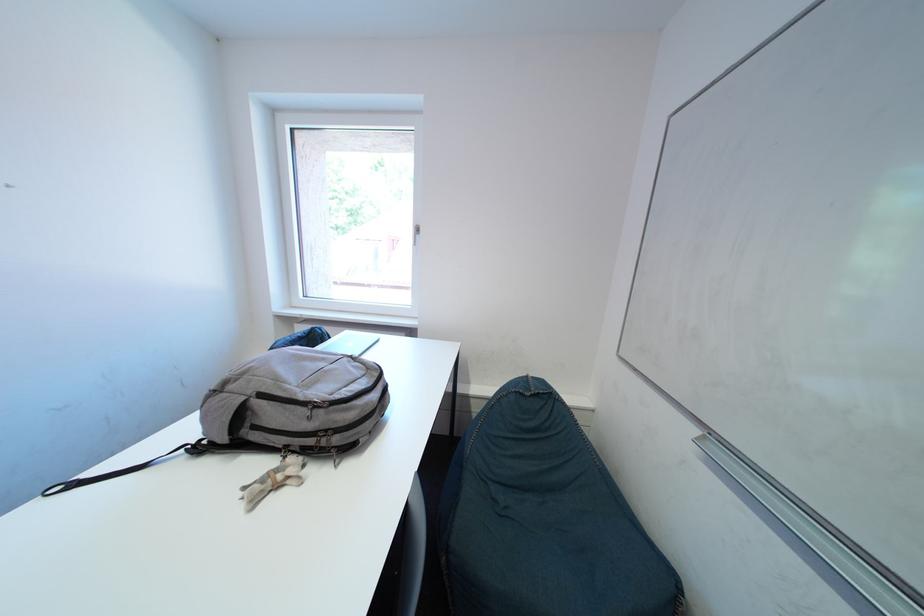
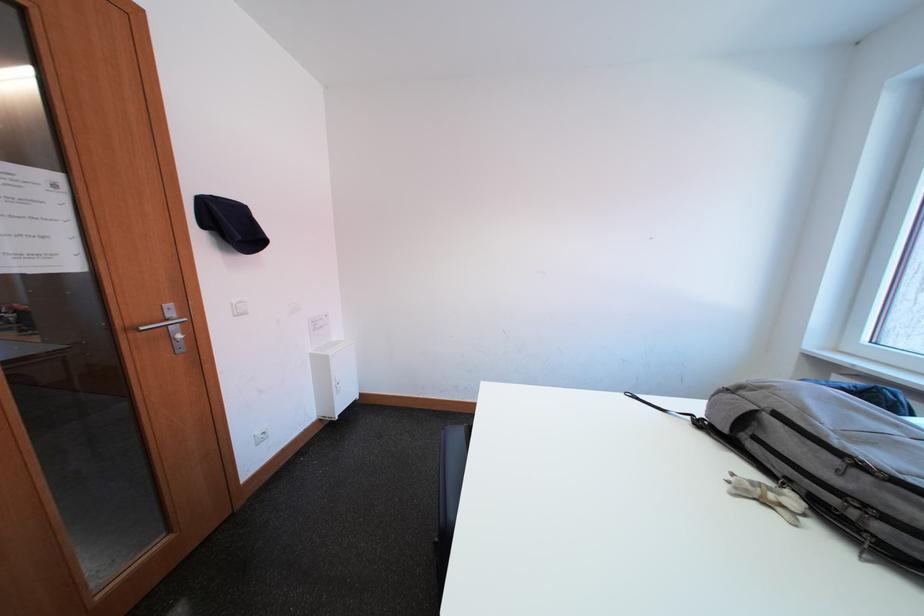
Locate, in the second image, the point that corresponds to point 224,456 in the first image.

(719, 438)